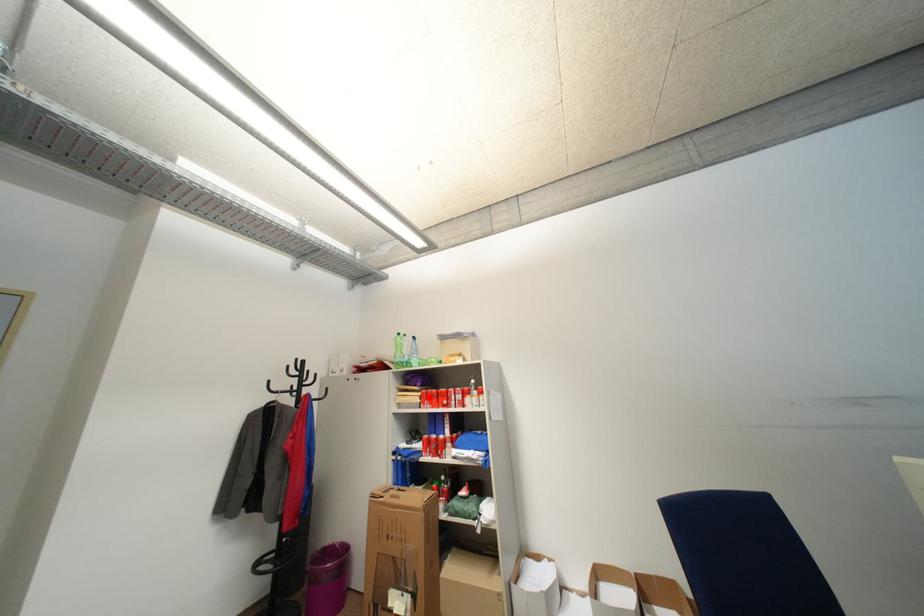
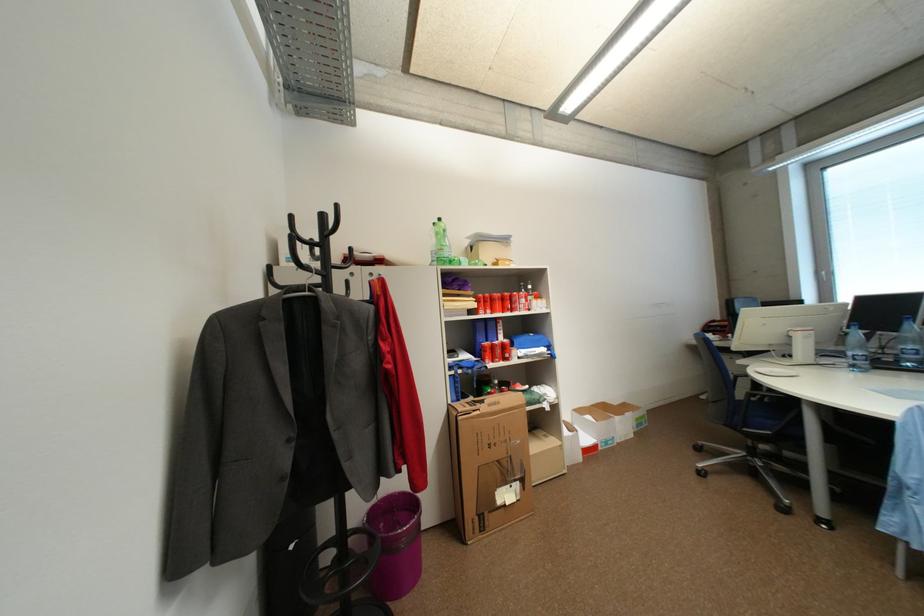
In the second image, find the point that corresponds to the highlighted location in the first image.

(485, 302)